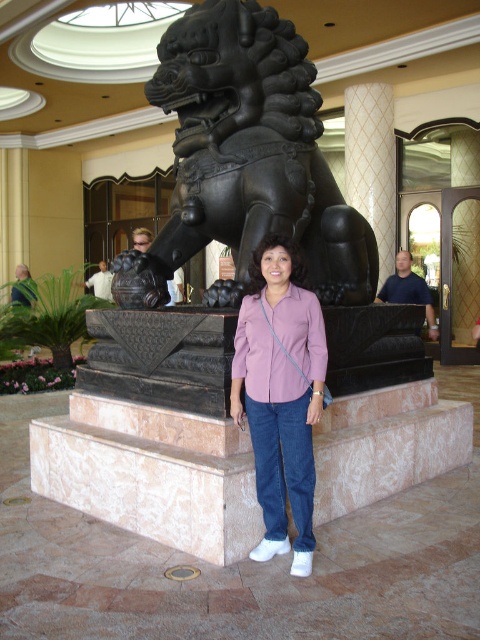
This screenshot has height=640, width=480. In order to click on black bronze lion at center in this screenshot , I will do `click(247, 161)`.

Is the position of matte purple shirt at center less distant than that of white textured pillar at center?

That is True.

Is matte purple shirt at center further to the viewer compared to white textured pillar at center?

No, matte purple shirt at center is in front of white textured pillar at center.

This screenshot has height=640, width=480. Find the location of `matte purple shirt at center`. matte purple shirt at center is located at coordinates (279, 346).

Where is `matte purple shirt at center`? The height and width of the screenshot is (640, 480). matte purple shirt at center is located at coordinates tap(279, 346).

Between black bronze lion at center and white textured pillar at center, which one appears on the right side from the viewer's perspective?

Positioned to the right is white textured pillar at center.

Does black bronze lion at center appear on the left side of white textured pillar at center?

Correct, you'll find black bronze lion at center to the left of white textured pillar at center.

Image resolution: width=480 pixels, height=640 pixels. In order to click on black bronze lion at center in this screenshot , I will do `click(247, 161)`.